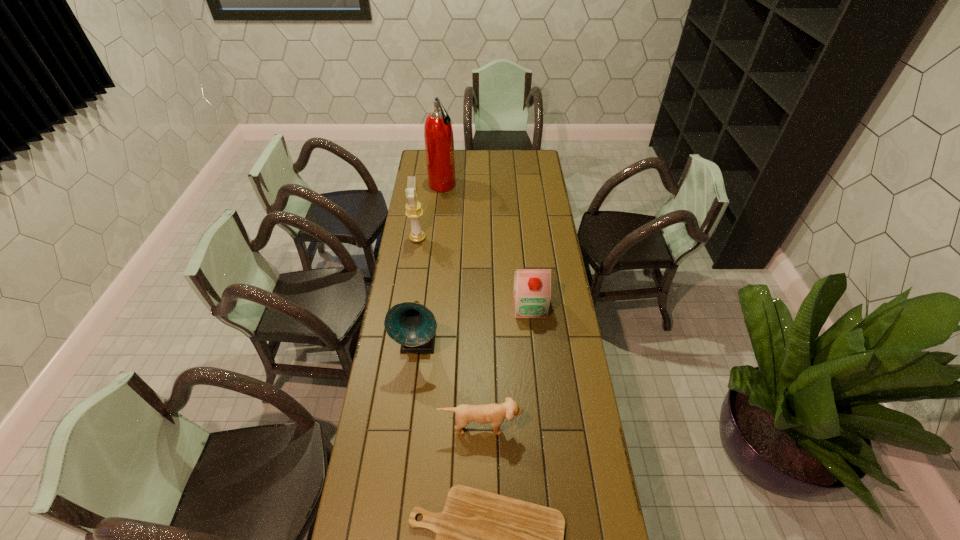
You are a GUI agent. You are given a task and a screenshot of the screen. Output one action in this format:
    pyautogui.click(x=<x>, y=<y>)
    Task: Click on the vacant space at the far right corner
    
    Given the screenshot: What is the action you would take?
    pyautogui.click(x=528, y=169)

At what (x,y) coordinates should I click in order to perform the action: click on vacant space that's between the fifth nearest object and the fire extinguisher. Please return your answer as a coordinate pair (x, y). The height and width of the screenshot is (540, 960). Looking at the image, I should click on (430, 212).

Where is `vacant area that lies between the fire extinguisher and the fifth nearest object`? This screenshot has height=540, width=960. vacant area that lies between the fire extinguisher and the fifth nearest object is located at coordinates (430, 212).

Locate an element on the screen. vacant area that lies between the fifth nearest object and the fire extinguisher is located at coordinates (430, 212).

This screenshot has height=540, width=960. What are the coordinates of `unoccupied position between the award and the puppy` in the screenshot? It's located at (449, 332).

Where is `free space between the phonograph_record and the puppy`? The image size is (960, 540). free space between the phonograph_record and the puppy is located at coordinates (449, 384).

This screenshot has width=960, height=540. In order to click on free space between the fifth farthest object and the phonograph_record in this screenshot , I will do `click(449, 384)`.

Image resolution: width=960 pixels, height=540 pixels. What are the coordinates of `unoccupied position between the fourth tallest object and the second nearest object` in the screenshot? It's located at (505, 366).

Find the location of `the closest object to the farthest object`. the closest object to the farthest object is located at coordinates (414, 211).

The height and width of the screenshot is (540, 960). What are the coordinates of `object that is the third closest to the third farthest object` in the screenshot? It's located at (414, 211).